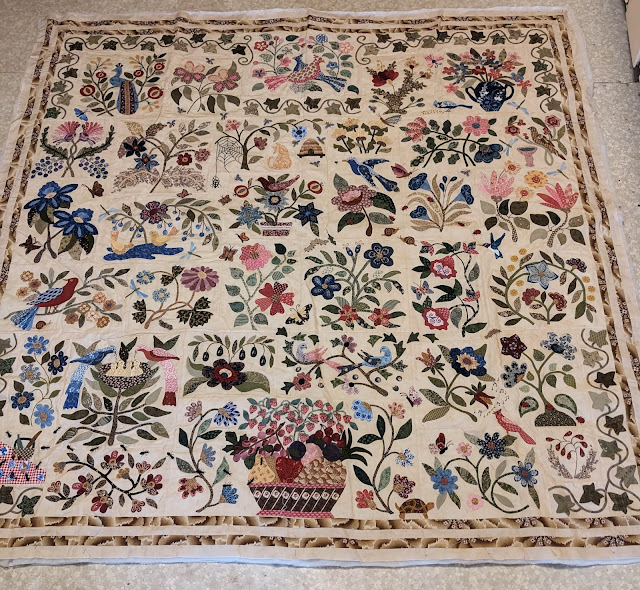
What are the coordinates of `rug` in the screenshot? It's located at (401, 261).